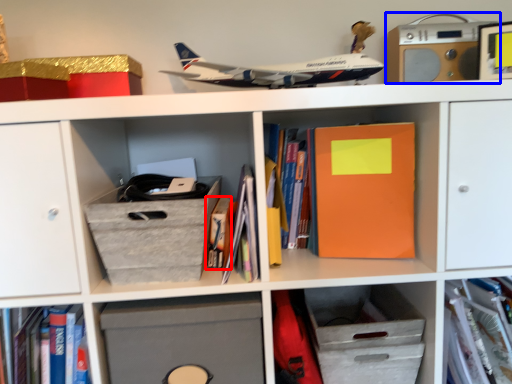
Question: Among these objects, which one is farthest to the camera, book (highlighted by a red box) or stereo (highlighted by a blue box)?

Choices:
 (A) book
 (B) stereo

Answer: (B)